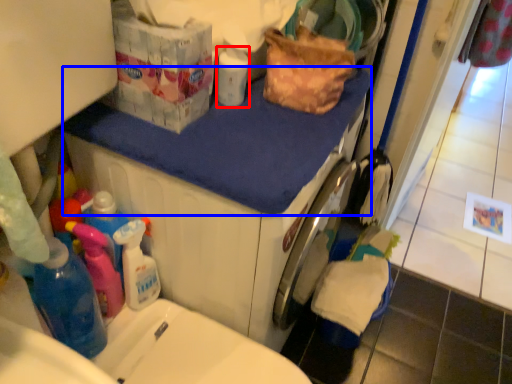
Question: Which object appears closest to the camera in this image, cleaning product (highlighted by a red box) or counter top (highlighted by a blue box)?

Choices:
 (A) cleaning product
 (B) counter top

Answer: (B)